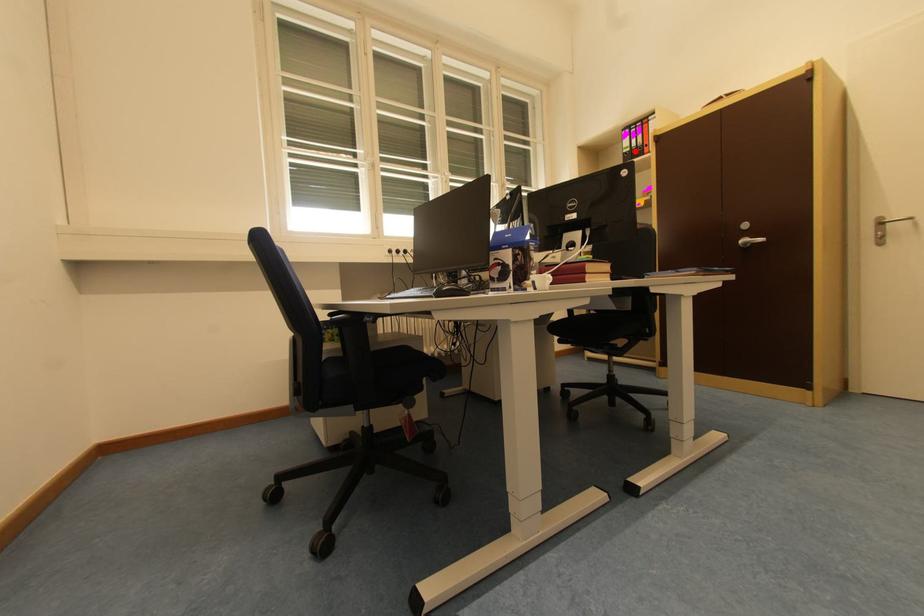
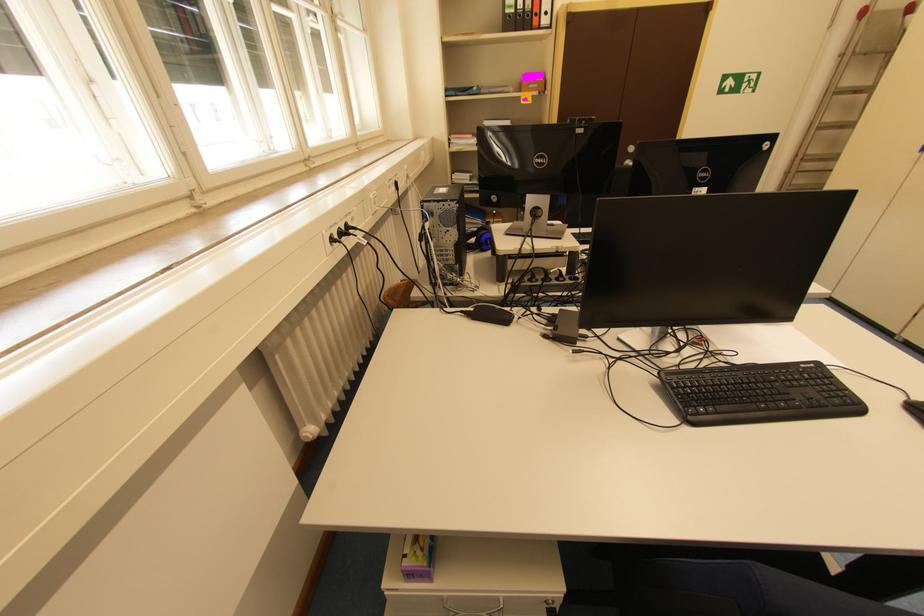
Locate, in the second image, the point that corresponds to the highlighted location in the first image.

(520, 12)